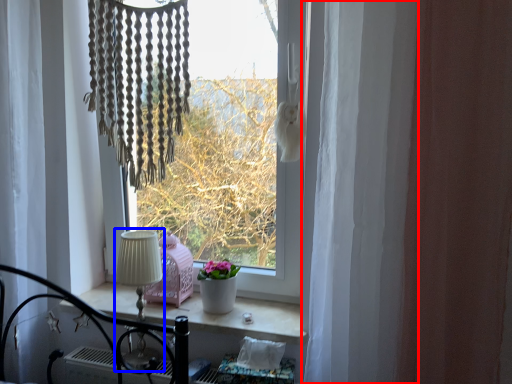
Question: Which of the following is the farthest to the observer, curtain (highlighted by a red box) or table lamp (highlighted by a blue box)?

Choices:
 (A) curtain
 (B) table lamp

Answer: (B)